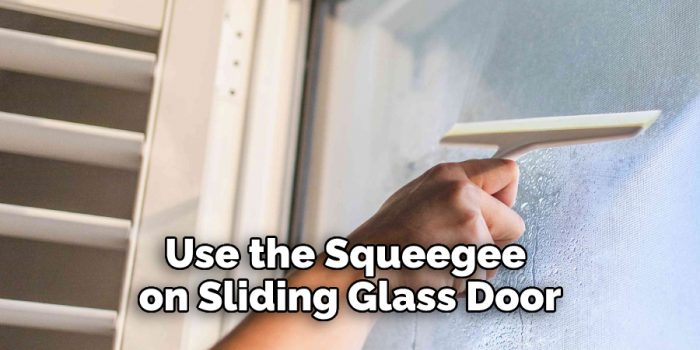
The width and height of the screenshot is (700, 350). I want to click on blinds, so click(x=112, y=59), click(x=82, y=143), click(x=68, y=236), click(x=55, y=315).